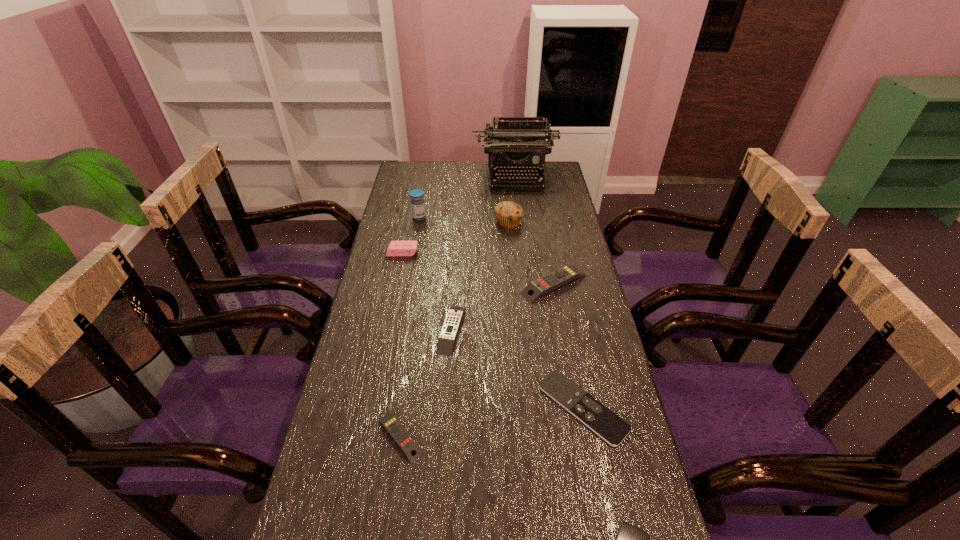
Find the location of a particular element. the fourth shortest object is located at coordinates (450, 328).

Locate an element on the screen. Image resolution: width=960 pixels, height=540 pixels. the seventh tallest object is located at coordinates (402, 438).

Find the location of a particular element. The image size is (960, 540). the leftmost remote control is located at coordinates (402, 438).

The height and width of the screenshot is (540, 960). I want to click on the farther black remote control, so click(610, 427).

Where is `the bigger black remote control`? This screenshot has width=960, height=540. the bigger black remote control is located at coordinates (610, 427).

The image size is (960, 540). Identify the location of vacant area located on the keyboard of the typewriter. (524, 252).

This screenshot has width=960, height=540. Identify the location of free space located 0.100m on the back of the medicine. (422, 200).

Where is `vacant space located 0.350m on the front of the muffin`? The image size is (960, 540). vacant space located 0.350m on the front of the muffin is located at coordinates (515, 295).

In order to click on free region located on the back of the pink eraser in this screenshot , I will do `click(409, 220)`.

The width and height of the screenshot is (960, 540). What are the coordinates of `vacant space located 0.380m on the back of the farthest yellow remote control` in the screenshot? It's located at (540, 206).